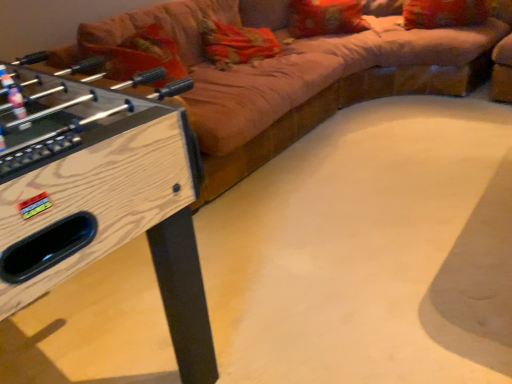
Question: In the image, is wooden foosball table at left on the left side or the right side of velvet-like red pillow at upper right, which ranks as the 2th pillow in left-to-right order?

Choices:
 (A) left
 (B) right

Answer: (A)

Question: Is wooden foosball table at left inside or outside of velvet-like red pillow at upper right, which ranks as the 2th pillow in left-to-right order?

Choices:
 (A) outside
 (B) inside

Answer: (A)

Question: Based on their relative distances, which object is nearer to the orange fabric pillow at upper center, marked as the second pillow in a right-to-left arrangement?

Choices:
 (A) velvet beige couch at upper center
 (B) wooden foosball table at left
 (C) velvet-like red pillow at upper right, which ranks as the 2th pillow in left-to-right order

Answer: (C)

Question: Estimate the real-world distances between objects in this image. Which object is farther from the wooden foosball table at left?

Choices:
 (A) orange fabric pillow at upper center, marked as the second pillow in a right-to-left arrangement
 (B) velvet-like red pillow at upper right, which ranks as the 2th pillow in left-to-right order
 (C) velvet beige couch at upper center

Answer: (B)